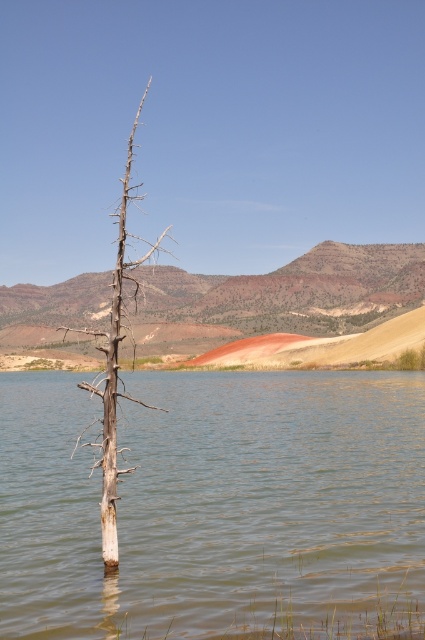
Is brown matte water at center to the right of dead wood tree at center from the viewer's perspective?

Indeed, brown matte water at center is positioned on the right side of dead wood tree at center.

Does brown matte water at center appear on the left side of dead wood tree at center?

Incorrect, brown matte water at center is not on the left side of dead wood tree at center.

Who is more distant from viewer, [371,508] or [121,202]?

The point [121,202] is behind.

In order to click on brown matte water at center in this screenshot , I will do `click(217, 508)`.